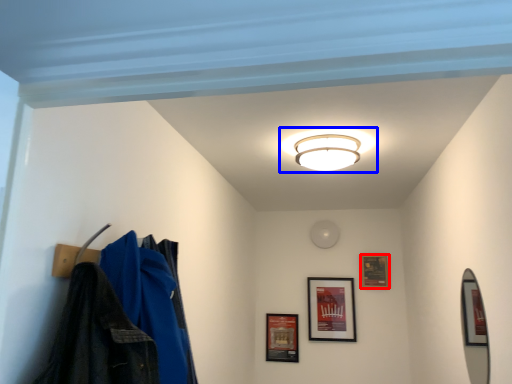
Question: Which object appears farthest to the camera in this image, picture frame (highlighted by a red box) or lamp (highlighted by a blue box)?

Choices:
 (A) picture frame
 (B) lamp

Answer: (A)